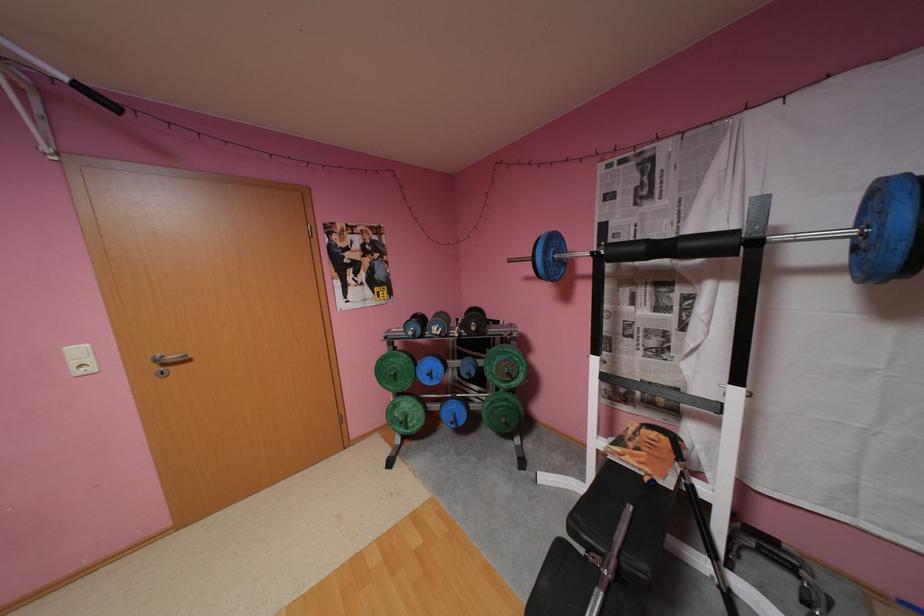
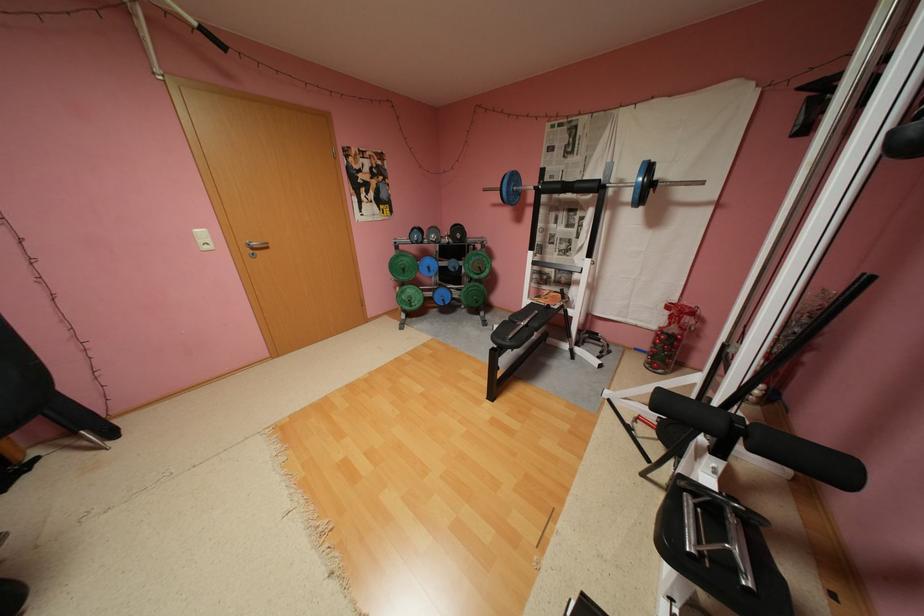
Question: Based on the continuous images, in which direction is the camera rotating? Reply with the corresponding letter.

Choices:
 (A) Left
 (B) Right
 (C) Up
 (D) Down

Answer: (D)